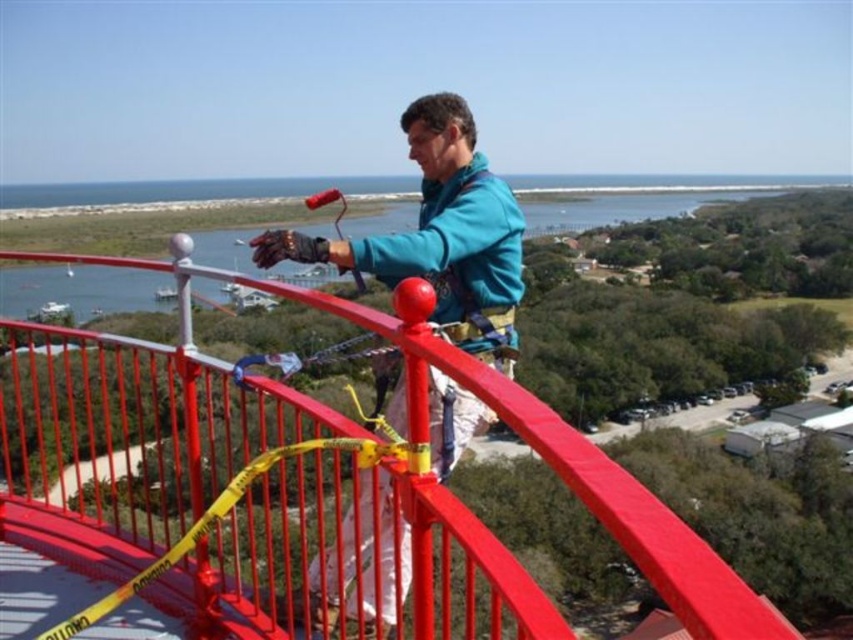
Question: Can you confirm if smooth metal railing at center is smaller than teal fabric jacket at center?

Choices:
 (A) no
 (B) yes

Answer: (A)

Question: Which point is closer to the camera taking this photo?

Choices:
 (A) (486, 380)
 (B) (485, 182)

Answer: (A)

Question: Can you confirm if smooth metal railing at center is bigger than teal fabric jacket at center?

Choices:
 (A) yes
 (B) no

Answer: (A)

Question: Is the position of smooth metal railing at center more distant than that of teal fabric jacket at center?

Choices:
 (A) yes
 (B) no

Answer: (B)